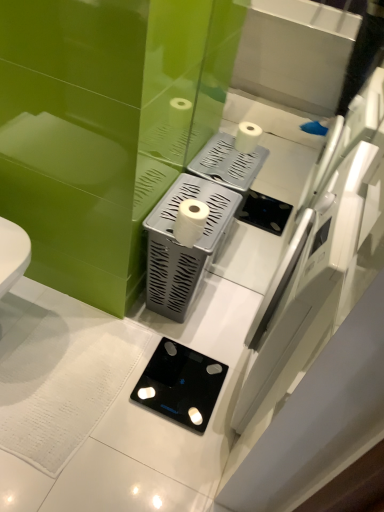
Question: Is black glass scale at lower center at the back of white matte toilet paper at center?

Choices:
 (A) no
 (B) yes

Answer: (A)

Question: From a real-world perspective, is white matte toilet paper at center on black glass scale at lower center?

Choices:
 (A) yes
 (B) no

Answer: (A)

Question: Can you confirm if white matte toilet paper at center is thinner than black glass scale at lower center?

Choices:
 (A) no
 (B) yes

Answer: (B)

Question: Are white matte toilet paper at center and black glass scale at lower center far apart?

Choices:
 (A) no
 (B) yes

Answer: (A)

Question: Does white matte toilet paper at center contain black glass scale at lower center?

Choices:
 (A) yes
 (B) no

Answer: (B)

Question: Is silver textured tissue holder at center taller or shorter than black glass scale at lower center?

Choices:
 (A) tall
 (B) short

Answer: (A)

Question: In the image, is silver textured tissue holder at center on the left side or the right side of black glass scale at lower center?

Choices:
 (A) right
 (B) left

Answer: (A)

Question: Looking at their shapes, would you say silver textured tissue holder at center is wider or thinner than black glass scale at lower center?

Choices:
 (A) wide
 (B) thin

Answer: (B)

Question: In the image, is silver textured tissue holder at center positioned in front of or behind black glass scale at lower center?

Choices:
 (A) front
 (B) behind

Answer: (A)

Question: Is white matte toilet paper at center in front of or behind black glass scale at lower center in the image?

Choices:
 (A) behind
 (B) front

Answer: (B)

Question: Looking at the image, does white matte toilet paper at center seem bigger or smaller compared to black glass scale at lower center?

Choices:
 (A) big
 (B) small

Answer: (A)

Question: Considering the positions of white matte toilet paper at center and black glass scale at lower center in the image, is white matte toilet paper at center wider or thinner than black glass scale at lower center?

Choices:
 (A) wide
 (B) thin

Answer: (B)

Question: Based on their positions, is white matte toilet paper at center located to the left or right of black glass scale at lower center?

Choices:
 (A) left
 (B) right

Answer: (B)

Question: From the image's perspective, is silver textured tissue holder at center located above or below white matte toilet paper at center?

Choices:
 (A) below
 (B) above

Answer: (A)

Question: Is silver textured tissue holder at center inside or outside of white matte toilet paper at center?

Choices:
 (A) outside
 (B) inside

Answer: (A)